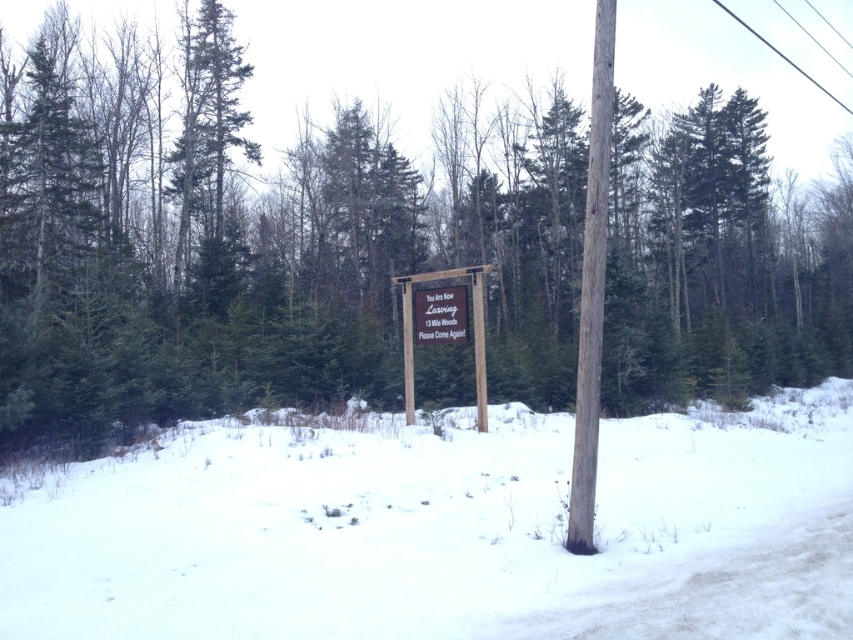
Question: Is white fluffy snow at lower center below smooth brown wood at right?

Choices:
 (A) no
 (B) yes

Answer: (B)

Question: Which of the following is the closest to the observer?

Choices:
 (A) metallic silver sign at center
 (B) brown wooden sign at center
 (C) white fluffy snow at lower center
 (D) smooth brown wood at right

Answer: (C)

Question: Does brown wooden sign at center appear on the right side of metallic silver sign at center?

Choices:
 (A) no
 (B) yes

Answer: (A)

Question: Which point is closer to the camera taking this photo?

Choices:
 (A) (596, 346)
 (B) (566, 435)
 (C) (462, 289)
 (D) (410, 369)

Answer: (A)

Question: Among these objects, which one is nearest to the camera?

Choices:
 (A) metallic silver sign at center
 (B) smooth brown wood at right
 (C) white fluffy snow at lower center
 (D) brown wooden sign at center

Answer: (C)

Question: From the image, what is the correct spatial relationship of white fluffy snow at lower center in relation to smooth brown wood at right?

Choices:
 (A) right
 (B) left

Answer: (B)